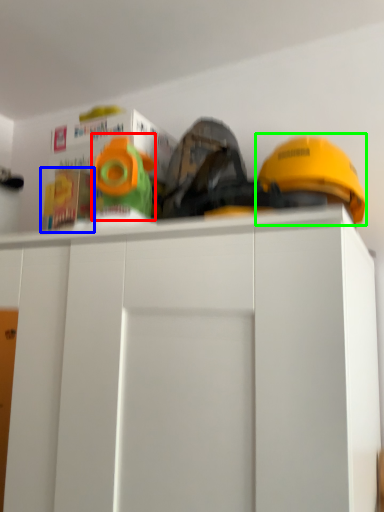
Question: Considering the real-world distances, which object is farthest from toy (highlighted by a red box)? toy (highlighted by a blue box) or helmet (highlighted by a green box)?

Choices:
 (A) toy
 (B) helmet

Answer: (B)